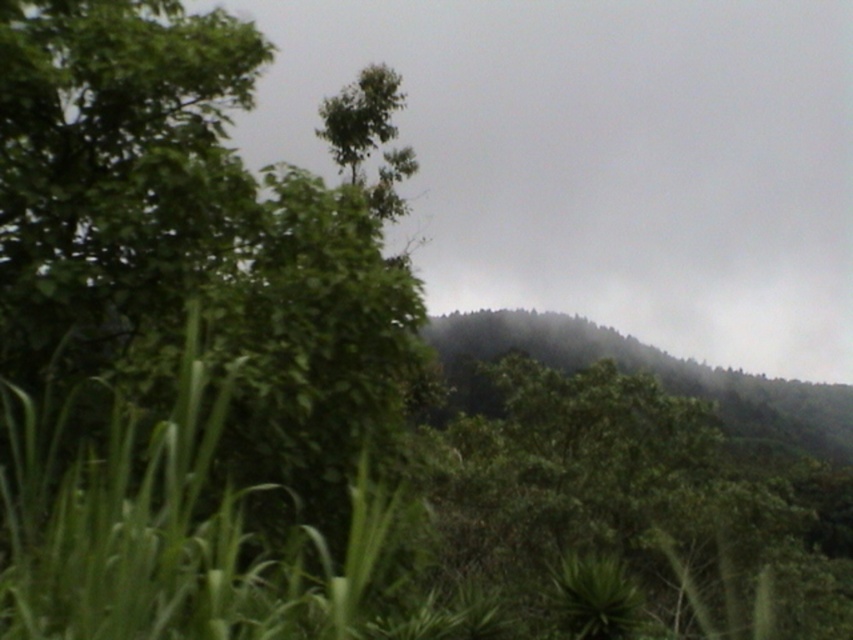
In the scene shown: Who is more forward, (x=386, y=138) or (x=467, y=332)?

Point (x=386, y=138) is in front.

Based on the photo, measure the distance from green leafy tree at upper left to dark green forest at center.

green leafy tree at upper left is 19.30 meters away from dark green forest at center.

This screenshot has width=853, height=640. Describe the element at coordinates (190, 237) in the screenshot. I see `green leafy tree at upper left` at that location.

Image resolution: width=853 pixels, height=640 pixels. I want to click on green leafy tree at upper left, so click(190, 237).

Which is in front, point (769, 189) or point (281, 401)?

Point (281, 401)

Is green leafy cloud at upper center bigger than green leafy tree at upper left?

Correct, green leafy cloud at upper center is larger in size than green leafy tree at upper left.

Is point (474, 56) farther from camera compared to point (0, 68)?

Yes, point (474, 56) is behind point (0, 68).

The image size is (853, 640). Find the location of `green leafy cloud at upper center`. green leafy cloud at upper center is located at coordinates (604, 157).

Is green leafy cloud at upper center positioned at the back of dark green forest at center?

No.

Is green leafy cloud at upper center wider than dark green forest at center?

Yes.

Image resolution: width=853 pixels, height=640 pixels. Describe the element at coordinates (604, 157) in the screenshot. I see `green leafy cloud at upper center` at that location.

You are a GUI agent. You are given a task and a screenshot of the screen. Output one action in this format:
    pyautogui.click(x=<x>, y=<y>)
    Task: Click on the green leafy cloud at upper center
    This screenshot has width=853, height=640.
    Given the screenshot: What is the action you would take?
    pyautogui.click(x=604, y=157)